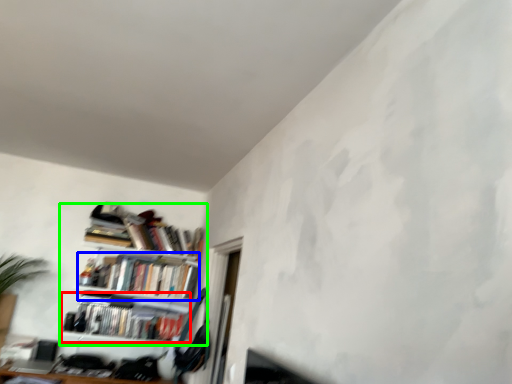
Question: Based on their relative distances, which object is farther from book (highlighted by a red box)? Choose from book (highlighted by a blue box) and shelf (highlighted by a green box).

Choices:
 (A) book
 (B) shelf

Answer: (A)